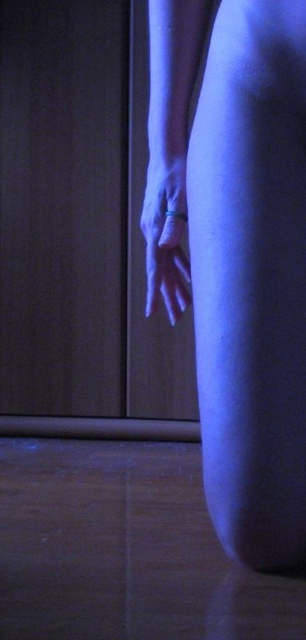
Which of these two, smooth skin at center or matte silver ring at lower center, stands shorter?

matte silver ring at lower center is shorter.

Does point (194, 262) come closer to viewer compared to point (182, 282)?

Yes, point (194, 262) is closer to viewer.

Find the location of a particular element. This screenshot has width=306, height=640. smooth skin at center is located at coordinates (237, 253).